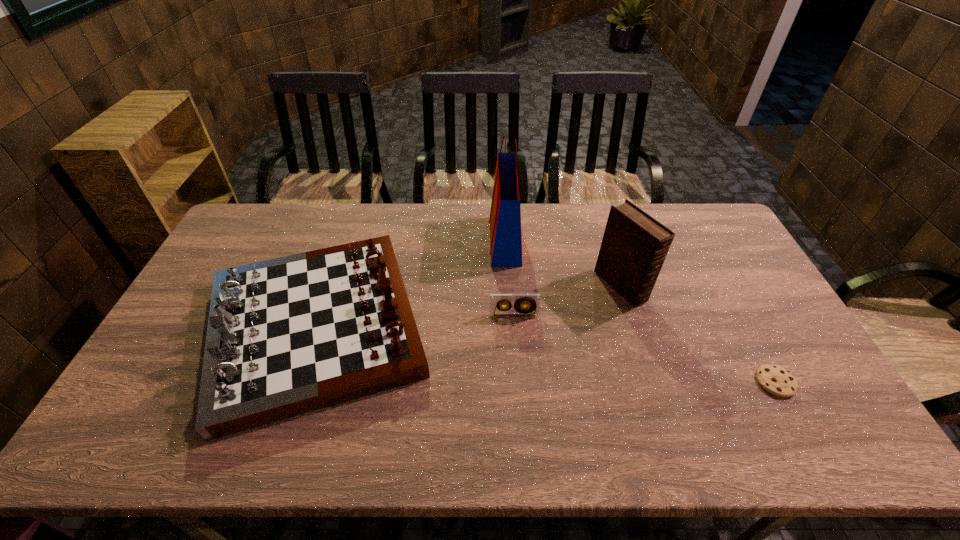
Where is `free space at the far edge`? The height and width of the screenshot is (540, 960). free space at the far edge is located at coordinates (398, 241).

Where is `vacant space at the near edge of the desktop`? The image size is (960, 540). vacant space at the near edge of the desktop is located at coordinates click(x=403, y=429).

You are a GUI agent. You are given a task and a screenshot of the screen. Output one action in this format:
    pyautogui.click(x=<x>, y=<y>)
    Task: Click on the free space at the left edge of the desktop
    The image size is (960, 540).
    Given the screenshot: What is the action you would take?
    pyautogui.click(x=174, y=327)

This screenshot has width=960, height=540. In the image, there is a desktop. In order to click on free space at the right edge in this screenshot , I will do `click(810, 373)`.

What are the coordinates of `blank space at the far left corner of the desktop` in the screenshot? It's located at (242, 228).

Locate an element on the screen. The width and height of the screenshot is (960, 540). vacant space at the far right corner of the desktop is located at coordinates (704, 204).

In the image, there is a desktop. Where is `vacant space at the near right corner`? vacant space at the near right corner is located at coordinates (848, 423).

Identify the location of empty space that is in between the rightmost object and the videotape. This screenshot has width=960, height=540. (644, 349).

Locate an element on the screen. This screenshot has height=540, width=960. vacant space that's between the fourth object from left to right and the leftmost object is located at coordinates (468, 307).

Where is `free space that is in between the videotape and the second object from right to left`? The width and height of the screenshot is (960, 540). free space that is in between the videotape and the second object from right to left is located at coordinates coord(567,301).